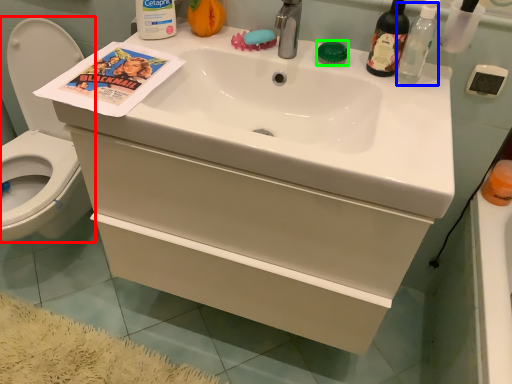
Question: Based on their relative distances, which object is nearer to toilet (highlighted by a red box)? Choose from bottle (highlighted by a blue box) and soap (highlighted by a green box).

Choices:
 (A) bottle
 (B) soap

Answer: (B)